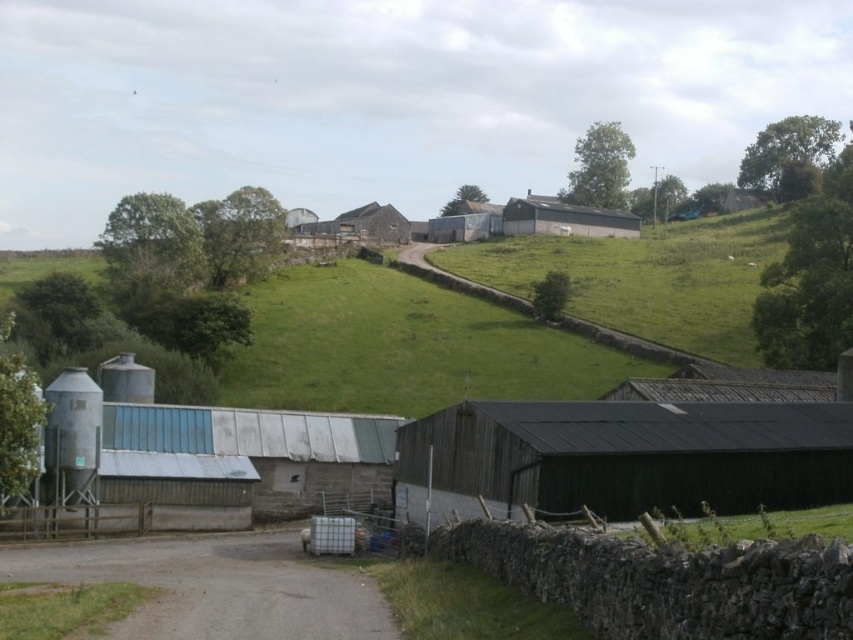
You are standing at point (47, 417) and want to walk to point (759, 284). Based on the farm scene described, will you have an unobstructed path to your destination?

Yes, you will have an unobstructed path to point 0.441, 0.891 because there are no objects blocking the way between the two points according to the scene description.

You are a farmer planning to install a new solar panel system. You need to choose between placing it on the roof of the metallic silo at left or the metallic corrugated barn at center. Based on their heights, which structure would allow the solar panels to be more elevated?

The metallic corrugated barn at center is taller than the metallic silo at left, so placing the solar panels on its roof would result in a higher elevation.

You are standing at the center of the driveway and want to move towards the metallic silo at left. Which direction should you head?

The metallic silo at left is located at point 0.680 on the x and 0.086 on the y coordinate, so you should head towards the left and slightly forward to reach it.